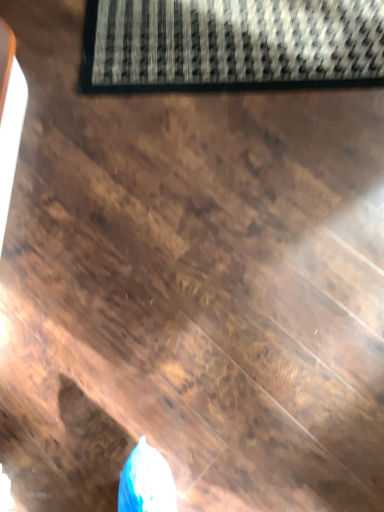
Question: Should I look upward or downward to see black textured mat at upper center?

Choices:
 (A) down
 (B) up

Answer: (B)